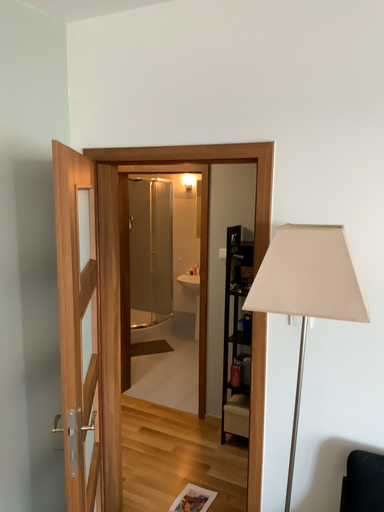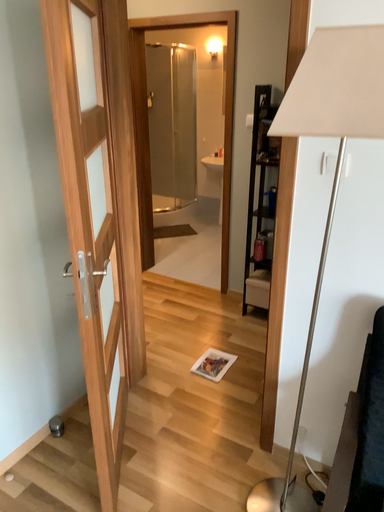
Question: Which way did the camera rotate in the video?

Choices:
 (A) rotated upward
 (B) rotated downward

Answer: (B)